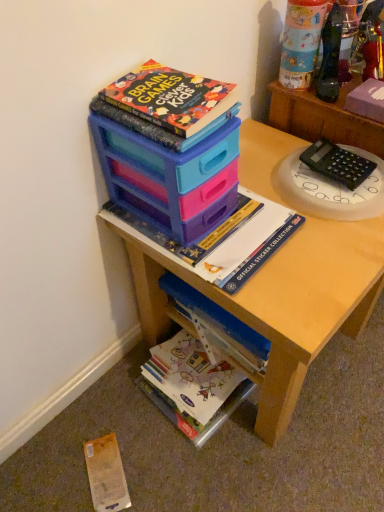
Locate an element on the screen. This screenshot has height=512, width=384. vacant space that's between white glossy book at lower center, the 3th book in the top-to-bottom sequence, and yellow paper at lower left is located at coordinates (132, 436).